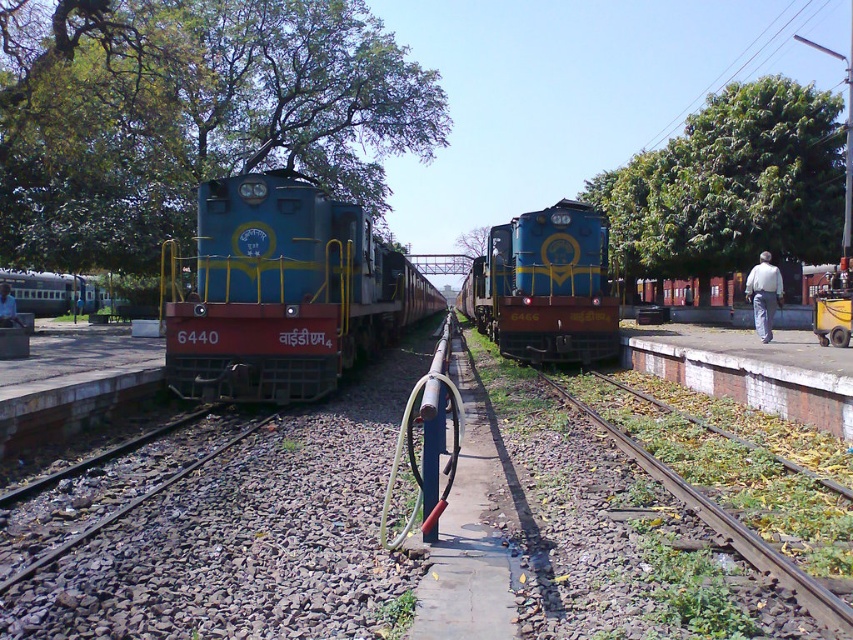
You are a train engineer who needs to ensure the matte blue train at center is properly aligned on the brown gravel train track at center. Based on the scene, is the train currently positioned correctly on the track?

The matte blue train at center is located above the brown gravel train track at center, so it is not positioned correctly on the track. The train should be placed directly on the track for proper alignment.

You are a train engineer who needs to navigate your locomotive through a narrow passage between the blue glossy locomotive at center and the green grassy track at lower right. Which direction should you steer your train to avoid collision?

The blue glossy locomotive at center is positioned on the right side of green grassy track at lower right, so you should steer your train to the left to avoid collision with the blue glossy locomotive at center.